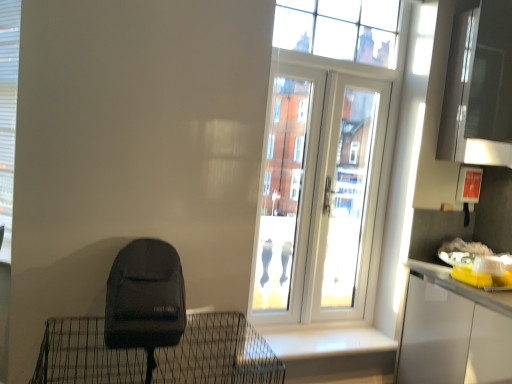
Question: Is white glossy window sill at lower center facing towards clear glass window at upper center?

Choices:
 (A) no
 (B) yes

Answer: (A)

Question: From a real-world perspective, does white glossy window sill at lower center stand above clear glass window at upper center?

Choices:
 (A) yes
 (B) no

Answer: (B)

Question: From a real-world perspective, is white glossy window sill at lower center beneath clear glass window at upper center?

Choices:
 (A) yes
 (B) no

Answer: (A)

Question: From the image's perspective, is white glossy window sill at lower center on top of clear glass window at upper center?

Choices:
 (A) no
 (B) yes

Answer: (A)

Question: Would you say white glossy window sill at lower center is outside clear glass window at upper center?

Choices:
 (A) yes
 (B) no

Answer: (A)

Question: Considering the relative positions of white glossy door at upper center and white plastic shutter at left in the image provided, is white glossy door at upper center to the left or to the right of white plastic shutter at left?

Choices:
 (A) left
 (B) right

Answer: (B)

Question: Is white glossy door at upper center taller or shorter than white plastic shutter at left?

Choices:
 (A) tall
 (B) short

Answer: (A)

Question: Considering the positions of point (x=296, y=137) and point (x=3, y=142), is point (x=296, y=137) closer or farther from the camera than point (x=3, y=142)?

Choices:
 (A) closer
 (B) farther

Answer: (B)

Question: Considering their positions, is white glossy door at upper center located in front of or behind white plastic shutter at left?

Choices:
 (A) behind
 (B) front

Answer: (A)

Question: Which is correct: black matte backpack at lower left is inside white glossy window sill at lower center, or outside of it?

Choices:
 (A) outside
 (B) inside

Answer: (A)

Question: Considering their positions, is black matte backpack at lower left located in front of or behind white glossy window sill at lower center?

Choices:
 (A) front
 (B) behind

Answer: (A)

Question: Considering the positions of point (218, 374) and point (392, 339), is point (218, 374) closer or farther from the camera than point (392, 339)?

Choices:
 (A) closer
 (B) farther

Answer: (A)

Question: Is black matte backpack at lower left bigger or smaller than white glossy window sill at lower center?

Choices:
 (A) small
 (B) big

Answer: (B)

Question: Is white glossy window sill at lower center to the left or to the right of clear glass window at upper center in the image?

Choices:
 (A) left
 (B) right

Answer: (A)

Question: Do you think white glossy window sill at lower center is within clear glass window at upper center, or outside of it?

Choices:
 (A) outside
 (B) inside

Answer: (A)